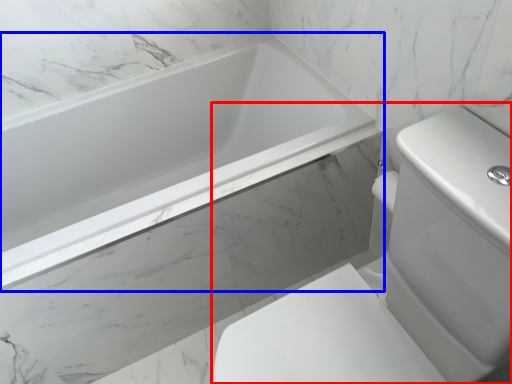
Question: Which object is further to the camera taking this photo, sink (highlighted by a red box) or bathtub (highlighted by a blue box)?

Choices:
 (A) sink
 (B) bathtub

Answer: (B)